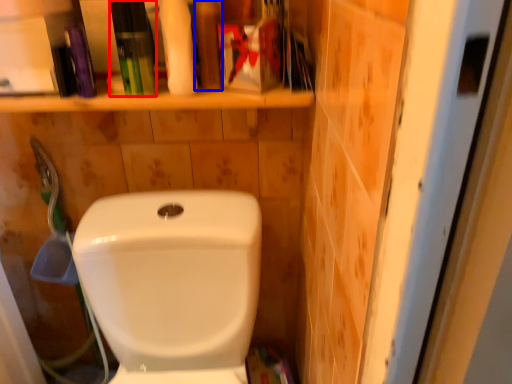
Question: Which object appears farthest to the camera in this image, toiletry (highlighted by a red box) or toiletry (highlighted by a blue box)?

Choices:
 (A) toiletry
 (B) toiletry

Answer: (B)